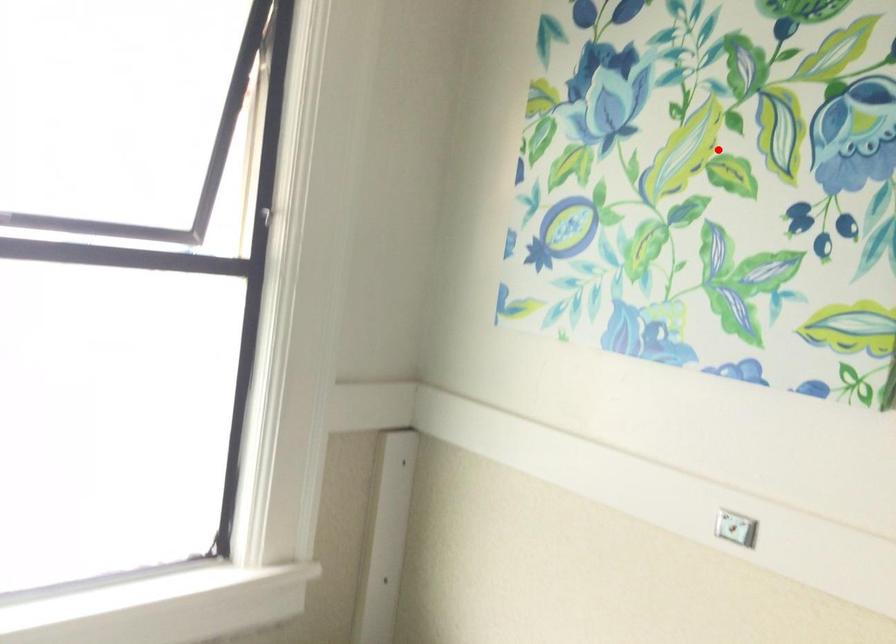
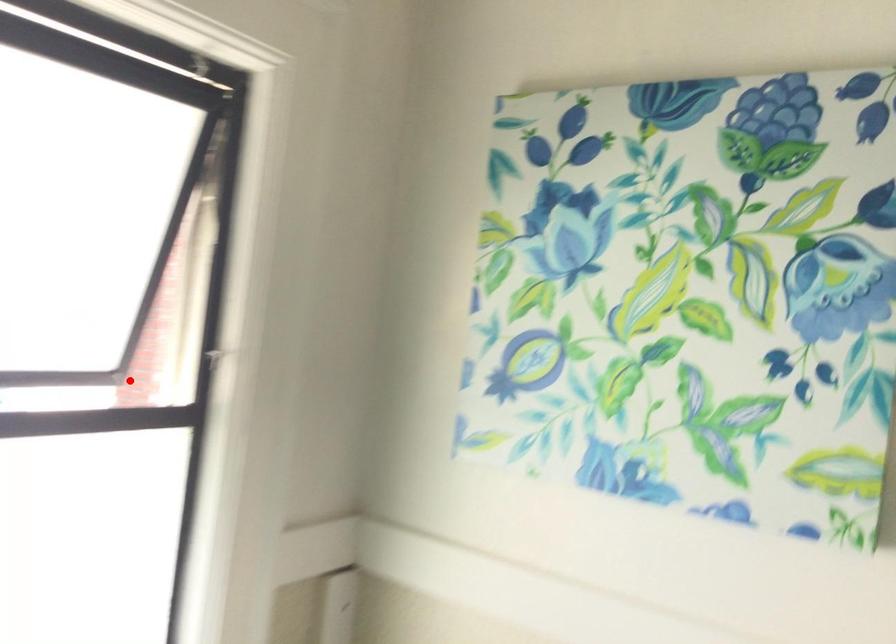
I am providing you with two images of the same scene from different viewpoints. A red point is marked on the first image and another point is marked on the second image. Is the marked point in image1 the same physical position as the marked point in image2?

No